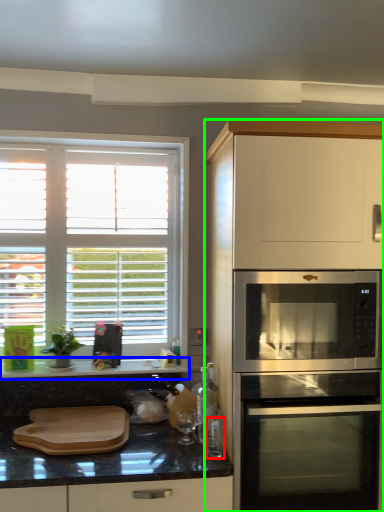
Question: Estimate the real-world distances between objects in this image. Which object is closer to appliance (highlighted by a red box), countertop (highlighted by a blue box) or cabinetry (highlighted by a green box)?

Choices:
 (A) countertop
 (B) cabinetry

Answer: (B)